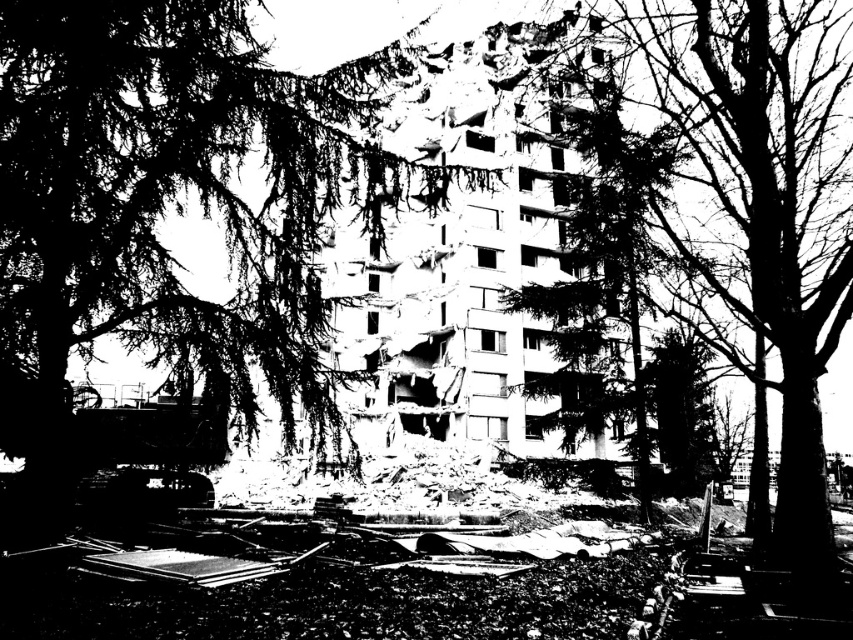
Is point (227, 52) positioned in front of point (724, 252)?

That is True.

Locate an element on the screen. The image size is (853, 640). dark green textured tree at left is located at coordinates (172, 204).

Does point (49, 220) come behind point (820, 435)?

No.

Locate an element on the screen. Image resolution: width=853 pixels, height=640 pixels. dark green textured tree at left is located at coordinates (172, 204).